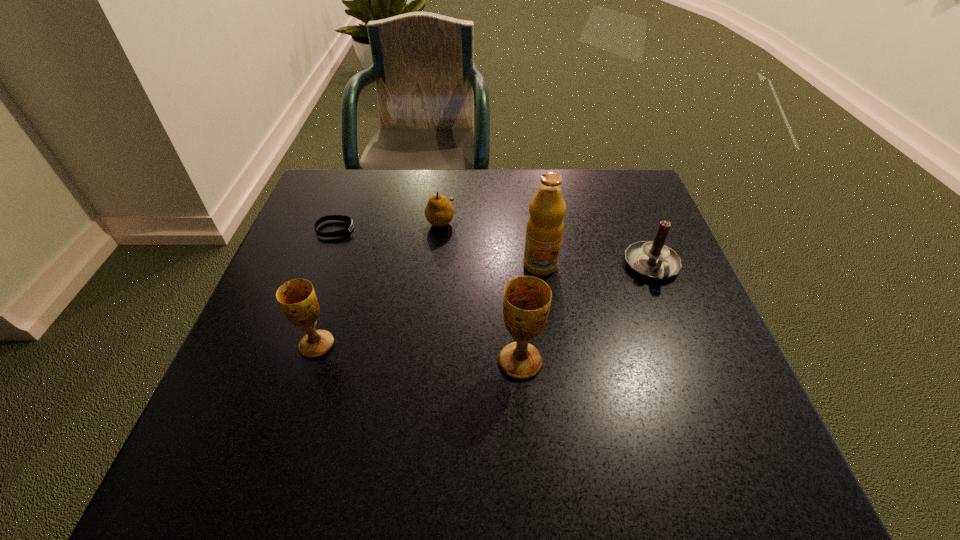
Locate an element on the screen. The image size is (960, 540). the shorter chalice is located at coordinates (297, 299).

You are a GUI agent. You are given a task and a screenshot of the screen. Output one action in this format:
    pyautogui.click(x=<x>, y=<y>)
    Task: Click on the left chalice
    Image resolution: width=960 pixels, height=540 pixels.
    Given the screenshot: What is the action you would take?
    pyautogui.click(x=297, y=299)

At what (x,y) coordinates should I click in order to perform the action: click on the fifth shortest object. Please return your answer as a coordinate pair (x, y). Looking at the image, I should click on (526, 303).

Find the location of `the right chalice`. the right chalice is located at coordinates (526, 303).

The height and width of the screenshot is (540, 960). I want to click on fruit juice, so click(545, 226).

Locate an element on the screen. pear is located at coordinates click(439, 212).

Where is `the second shortest object`? The image size is (960, 540). the second shortest object is located at coordinates (439, 212).

Where is `candle`? candle is located at coordinates (652, 259).

I want to click on the third shortest object, so click(652, 259).

Where is `the shortest object`? This screenshot has height=540, width=960. the shortest object is located at coordinates (346, 231).